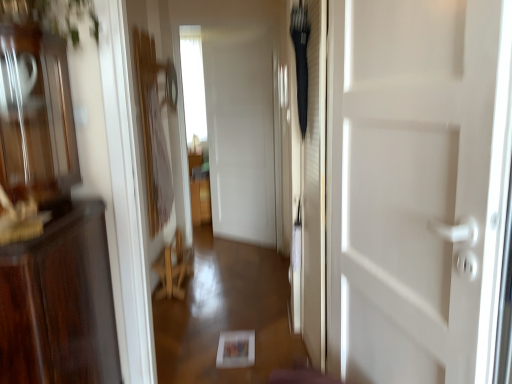
Where is `free location to the right of wooden chair at center`? This screenshot has width=512, height=384. free location to the right of wooden chair at center is located at coordinates (211, 280).